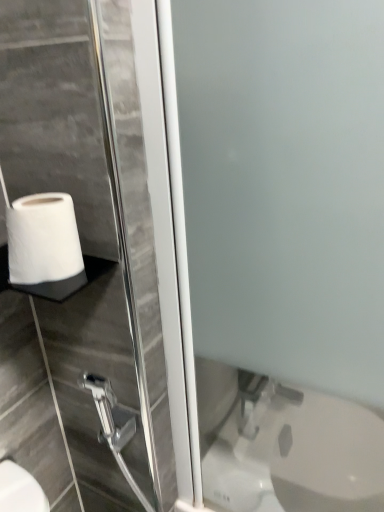
The image size is (384, 512). Describe the element at coordinates (43, 240) in the screenshot. I see `white matte toilet paper at lower left` at that location.

At what (x,y) coordinates should I click in order to perform the action: click on metallic silver shower head at lower left. Please return your answer as a coordinate pair (x, y). Looking at the image, I should click on (109, 412).

Considering the positions of objects white matte toilet paper at lower left and metallic silver shower head at lower left in the image provided, who is in front, white matte toilet paper at lower left or metallic silver shower head at lower left?

white matte toilet paper at lower left is closer to the camera.

Is white matte toilet paper at lower left inside the boundaries of metallic silver shower head at lower left, or outside?

white matte toilet paper at lower left is outside metallic silver shower head at lower left.

Considering the relative sizes of white matte toilet paper at lower left and metallic silver shower head at lower left in the image provided, is white matte toilet paper at lower left thinner than metallic silver shower head at lower left?

Incorrect, the width of white matte toilet paper at lower left is not less than that of metallic silver shower head at lower left.

Does point (221, 218) appear closer or farther from the camera than point (41, 239)?

Point (221, 218) is farther from the camera than point (41, 239).

Where is `toilet paper that appears on the left of frosted glass screen door at center`? This screenshot has height=512, width=384. toilet paper that appears on the left of frosted glass screen door at center is located at coordinates (43, 240).

Is white matte toilet paper at lower left at the back of frosted glass screen door at center?

No, frosted glass screen door at center is not facing away from white matte toilet paper at lower left.

How different are the orientations of frosted glass screen door at center and white matte toilet paper at lower left in degrees?

frosted glass screen door at center and white matte toilet paper at lower left are facing 90.2 degrees away from each other.

Could you tell me if frosted glass screen door at center is turned towards metallic silver shower head at lower left?

No, frosted glass screen door at center is not oriented towards metallic silver shower head at lower left.

In the image, there is a metallic silver shower head at lower left. What are the coordinates of `screen door above it (from the image's perspective)` in the screenshot? It's located at (285, 187).

Is frosted glass screen door at center far away from metallic silver shower head at lower left?

Actually, frosted glass screen door at center and metallic silver shower head at lower left are a little close together.

Considering the sizes of objects frosted glass screen door at center and metallic silver shower head at lower left in the image provided, who is bigger, frosted glass screen door at center or metallic silver shower head at lower left?

frosted glass screen door at center is bigger.

Can you confirm if white matte toilet paper at lower left is taller than frosted glass screen door at center?

Incorrect, the height of white matte toilet paper at lower left is not larger of that of frosted glass screen door at center.

Locate an element on the screen. This screenshot has width=384, height=512. toilet paper lying above the frosted glass screen door at center (from the image's perspective) is located at coordinates (43, 240).

Is white matte toilet paper at lower left facing towards frosted glass screen door at center?

No, white matte toilet paper at lower left is not aimed at frosted glass screen door at center.

Is point (81, 252) positioned after point (221, 71)?

That is True.

Is metallic silver shower head at lower left spatially inside frosted glass screen door at center, or outside of it?

metallic silver shower head at lower left is outside frosted glass screen door at center.

In the scene shown: From the image's perspective, which one is positioned higher, metallic silver shower head at lower left or frosted glass screen door at center?

frosted glass screen door at center appears higher in the image.

How many degrees apart are the facing directions of metallic silver shower head at lower left and frosted glass screen door at center?

89.2 degrees.

Is metallic silver shower head at lower left aimed at frosted glass screen door at center?

No, metallic silver shower head at lower left is not facing towards frosted glass screen door at center.

From the picture: From the image's perspective, would you say metallic silver shower head at lower left is shown under white matte toilet paper at lower left?

Indeed, from the image's perspective, metallic silver shower head at lower left is shown beneath white matte toilet paper at lower left.

Does point (121, 428) appear closer or farther from the camera than point (59, 211)?

Point (121, 428).

Which of these two, metallic silver shower head at lower left or white matte toilet paper at lower left, is smaller?

metallic silver shower head at lower left.

Between metallic silver shower head at lower left and white matte toilet paper at lower left, which one has larger width?

white matte toilet paper at lower left is wider.

Identify the location of toilet paper above the metallic silver shower head at lower left (from a real-world perspective). The height and width of the screenshot is (512, 384). (43, 240).

Image resolution: width=384 pixels, height=512 pixels. Identify the location of toilet paper behind the frosted glass screen door at center. (43, 240).

Estimate the real-world distances between objects in this image. Which object is further from white matte toilet paper at lower left, frosted glass screen door at center or metallic silver shower head at lower left?

The object further to white matte toilet paper at lower left is metallic silver shower head at lower left.

Estimate the real-world distances between objects in this image. Which object is further from frosted glass screen door at center, metallic silver shower head at lower left or white matte toilet paper at lower left?

Based on the image, metallic silver shower head at lower left appears to be further to frosted glass screen door at center.

Estimate the real-world distances between objects in this image. Which object is further from metallic silver shower head at lower left, frosted glass screen door at center or white matte toilet paper at lower left?

Based on the image, frosted glass screen door at center appears to be further to metallic silver shower head at lower left.

Based on their spatial positions, is metallic silver shower head at lower left or frosted glass screen door at center closer to white matte toilet paper at lower left?

Based on the image, frosted glass screen door at center appears to be nearer to white matte toilet paper at lower left.

From the image, which object appears to be nearer to frosted glass screen door at center, white matte toilet paper at lower left or metallic silver shower head at lower left?

white matte toilet paper at lower left is closer to frosted glass screen door at center.

Looking at the image, which one is located further to metallic silver shower head at lower left, white matte toilet paper at lower left or frosted glass screen door at center?

The object further to metallic silver shower head at lower left is frosted glass screen door at center.

Locate an element on the screen. This screenshot has width=384, height=512. toilet paper located between frosted glass screen door at center and metallic silver shower head at lower left in the depth direction is located at coordinates (43, 240).